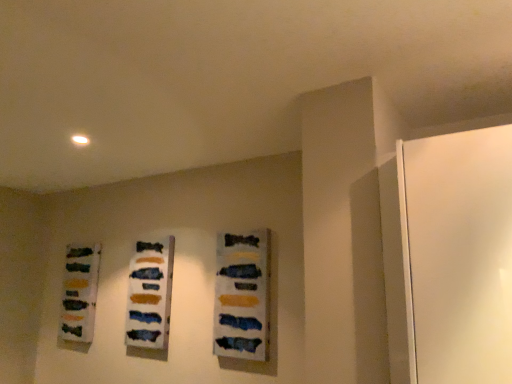
What do you see at coordinates (79, 292) in the screenshot? I see `matte glass bottles at left, arranged as the 3th art when viewed from the front` at bounding box center [79, 292].

Find the location of a particular element. matte acrylic painting at center, the third art when ordered from back to front is located at coordinates (242, 295).

Can you confirm if matte acrylic painting at center, the third art when ordered from back to front, is taller than matte glass bottles at left, which appears as the first art when viewed from the back?

Yes, matte acrylic painting at center, the third art when ordered from back to front, is taller than matte glass bottles at left, which appears as the first art when viewed from the back.

Is matte acrylic painting at center, the third art when ordered from back to front, wider or thinner than matte glass bottles at left, arranged as the 3th art when viewed from the front?

matte acrylic painting at center, the third art when ordered from back to front, is thinner than matte glass bottles at left, arranged as the 3th art when viewed from the front.

Is matte acrylic painting at center, which is the first art from front to back, at the right side of matte glass bottles at left, arranged as the 3th art when viewed from the right?

Indeed, matte acrylic painting at center, which is the first art from front to back, is positioned on the right side of matte glass bottles at left, arranged as the 3th art when viewed from the right.

Measure the distance between matte acrylic painting at center, which is the first art from front to back, and matte glass bottles at left, arranged as the 3th art when viewed from the right.

matte acrylic painting at center, which is the first art from front to back, is 1.08 meters from matte glass bottles at left, arranged as the 3th art when viewed from the right.

Is matte acrylic painting at center, the 2th art from the right, inside the boundaries of matte acrylic painting at center, the third art when ordered from back to front, or outside?

matte acrylic painting at center, the 2th art from the right, is located beyond the bounds of matte acrylic painting at center, the third art when ordered from back to front.

Between matte acrylic painting at center, which ranks as the second art in left-to-right order, and matte acrylic painting at center, which is the first art from front to back, which one appears on the left side from the viewer's perspective?

Positioned to the left is matte acrylic painting at center, which ranks as the second art in left-to-right order.

From a real-world perspective, does matte acrylic painting at center, which ranks as the second art in left-to-right order, sit lower than matte acrylic painting at center, the third art when ordered from back to front?

Correct, in the physical world, matte acrylic painting at center, which ranks as the second art in left-to-right order, is lower than matte acrylic painting at center, the third art when ordered from back to front.

From a real-world perspective, is matte glass bottles at left, which appears as the first art when viewed from the back, below matte acrylic painting at center, the 2th art from the right?

No, from a real-world perspective, matte glass bottles at left, which appears as the first art when viewed from the back, is not below matte acrylic painting at center, the 2th art from the right.

Which of these two, matte glass bottles at left, arranged as the 3th art when viewed from the right, or matte acrylic painting at center, which ranks as the second art in front-to-back order, stands taller?

matte acrylic painting at center, which ranks as the second art in front-to-back order, is taller.

Based on the photo, are matte glass bottles at left, the 1th art from the left, and matte acrylic painting at center, which appears as the second art when viewed from the back, far apart?

No, matte glass bottles at left, the 1th art from the left, is in close proximity to matte acrylic painting at center, which appears as the second art when viewed from the back.

From the image's perspective, which is above, matte glass bottles at left, arranged as the 3th art when viewed from the right, or matte acrylic painting at center, which ranks as the second art in left-to-right order?

matte acrylic painting at center, which ranks as the second art in left-to-right order, appears higher in the image.

Is point (231, 316) closer to camera compared to point (163, 267)?

Yes, it is.

Is matte acrylic painting at center, the third art when ordered from back to front, not inside matte acrylic painting at center, which appears as the second art when viewed from the back?

matte acrylic painting at center, the third art when ordered from back to front, lies outside matte acrylic painting at center, which appears as the second art when viewed from the back,'s area.

From the matte acrylic painting at center, the third art when ordered from left to right, count the 1st art to the left and point to it. Please provide its 2D coordinates.

[(150, 294)]

Can you confirm if matte acrylic painting at center, the third art when ordered from back to front, is wider than matte acrylic painting at center, which ranks as the second art in left-to-right order?

Incorrect, the width of matte acrylic painting at center, the third art when ordered from back to front, does not surpass that of matte acrylic painting at center, which ranks as the second art in left-to-right order.

How much distance is there between matte glass bottles at left, arranged as the 3th art when viewed from the right, and matte acrylic painting at center, the first art positioned from the right?

matte glass bottles at left, arranged as the 3th art when viewed from the right, and matte acrylic painting at center, the first art positioned from the right, are 3.56 feet apart.

This screenshot has height=384, width=512. I want to click on the 2nd art to the left when counting from the matte acrylic painting at center, the third art when ordered from back to front, so click(x=79, y=292).

Between matte glass bottles at left, arranged as the 3th art when viewed from the right, and matte acrylic painting at center, the third art when ordered from left to right, which one has less height?

With less height is matte glass bottles at left, arranged as the 3th art when viewed from the right.

Does matte glass bottles at left, arranged as the 3th art when viewed from the front, come behind matte acrylic painting at center, the third art when ordered from left to right?

Yes, matte glass bottles at left, arranged as the 3th art when viewed from the front, is further from the camera.

How different are the orientations of matte acrylic painting at center, which appears as the second art when viewed from the back, and matte glass bottles at left, which appears as the first art when viewed from the back, in degrees?

0.474 degrees.

Is matte acrylic painting at center, the 2th art from the right, in front of matte glass bottles at left, the 1th art from the left?

Yes, the depth of matte acrylic painting at center, the 2th art from the right, is less than that of matte glass bottles at left, the 1th art from the left.

Could you measure the distance between matte acrylic painting at center, which ranks as the second art in front-to-back order, and matte glass bottles at left, which appears as the first art when viewed from the back?

The distance of matte acrylic painting at center, which ranks as the second art in front-to-back order, from matte glass bottles at left, which appears as the first art when viewed from the back, is 18.87 inches.

Looking at the image, does matte acrylic painting at center, which appears as the second art when viewed from the back, seem bigger or smaller compared to matte glass bottles at left, the 1th art from the left?

Clearly, matte acrylic painting at center, which appears as the second art when viewed from the back, is smaller in size than matte glass bottles at left, the 1th art from the left.

The width and height of the screenshot is (512, 384). What are the coordinates of `the 2nd art below the matte acrylic painting at center, the third art when ordered from back to front (from the image's perspective)` in the screenshot? It's located at (79, 292).

Image resolution: width=512 pixels, height=384 pixels. Find the location of `art above the matte acrylic painting at center, which ranks as the second art in front-to-back order (from the image's perspective)`. art above the matte acrylic painting at center, which ranks as the second art in front-to-back order (from the image's perspective) is located at coordinates (242, 295).

Considering their positions, is matte acrylic painting at center, which appears as the second art when viewed from the back, positioned closer to matte acrylic painting at center, the third art when ordered from left to right, than matte glass bottles at left, arranged as the 3th art when viewed from the right?

matte acrylic painting at center, which appears as the second art when viewed from the back, lies closer to matte acrylic painting at center, the third art when ordered from left to right, than the other object.

Which object lies further to the anchor point matte acrylic painting at center, the 2th art from the right, matte glass bottles at left, which appears as the first art when viewed from the back, or matte acrylic painting at center, the third art when ordered from back to front?

The object further to matte acrylic painting at center, the 2th art from the right, is matte glass bottles at left, which appears as the first art when viewed from the back.

Based on their spatial positions, is matte acrylic painting at center, the 2th art from the right, or matte acrylic painting at center, the third art when ordered from left to right, closer to matte glass bottles at left, the 1th art from the left?

The object closer to matte glass bottles at left, the 1th art from the left, is matte acrylic painting at center, the 2th art from the right.

Looking at the image, which one is located further to matte glass bottles at left, arranged as the 3th art when viewed from the front, matte acrylic painting at center, which is the first art from front to back, or matte acrylic painting at center, which ranks as the second art in left-to-right order?

Among the two, matte acrylic painting at center, which is the first art from front to back, is located further to matte glass bottles at left, arranged as the 3th art when viewed from the front.

Considering their positions, is matte glass bottles at left, arranged as the 3th art when viewed from the front, positioned further to matte acrylic painting at center, the first art positioned from the right, than matte acrylic painting at center, which appears as the second art when viewed from the back?

matte glass bottles at left, arranged as the 3th art when viewed from the front, is positioned further to the anchor matte acrylic painting at center, the first art positioned from the right.

From the image, which object appears to be nearer to matte acrylic painting at center, the 2th art from the right, matte acrylic painting at center, which is the first art from front to back, or matte glass bottles at left, the 1th art from the left?

matte acrylic painting at center, which is the first art from front to back, is positioned closer to the anchor matte acrylic painting at center, the 2th art from the right.

Identify the location of art between matte glass bottles at left, arranged as the 3th art when viewed from the right, and matte acrylic painting at center, the first art positioned from the right. 150,294.